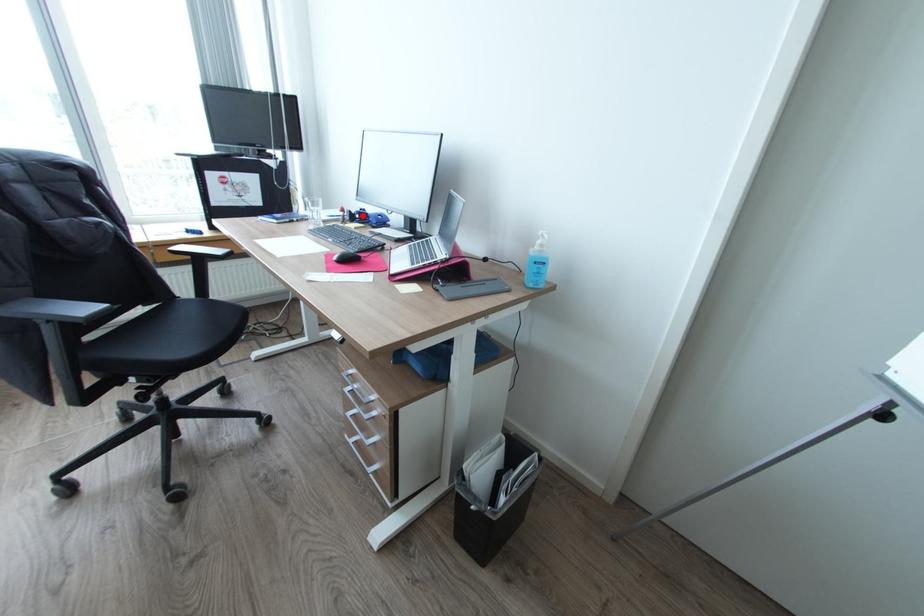
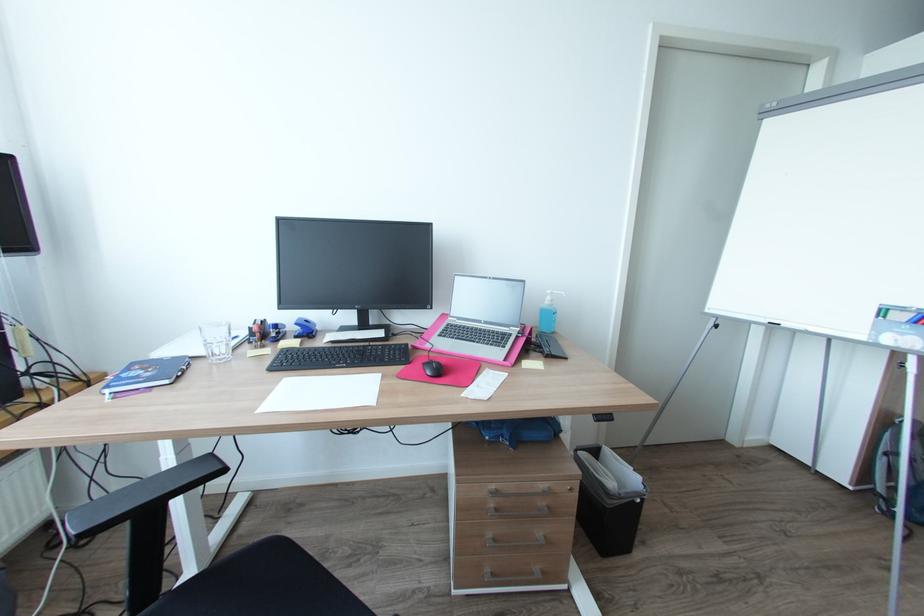
Where in the second image is the point corresponding to the highlighted location from the first image?

(277, 331)